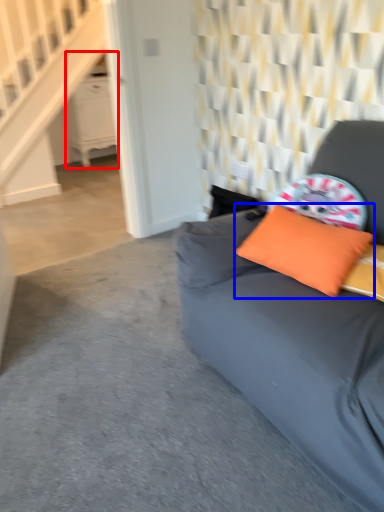
Question: Which object appears farthest to the camera in this image, dresser (highlighted by a red box) or pillow (highlighted by a blue box)?

Choices:
 (A) dresser
 (B) pillow

Answer: (A)